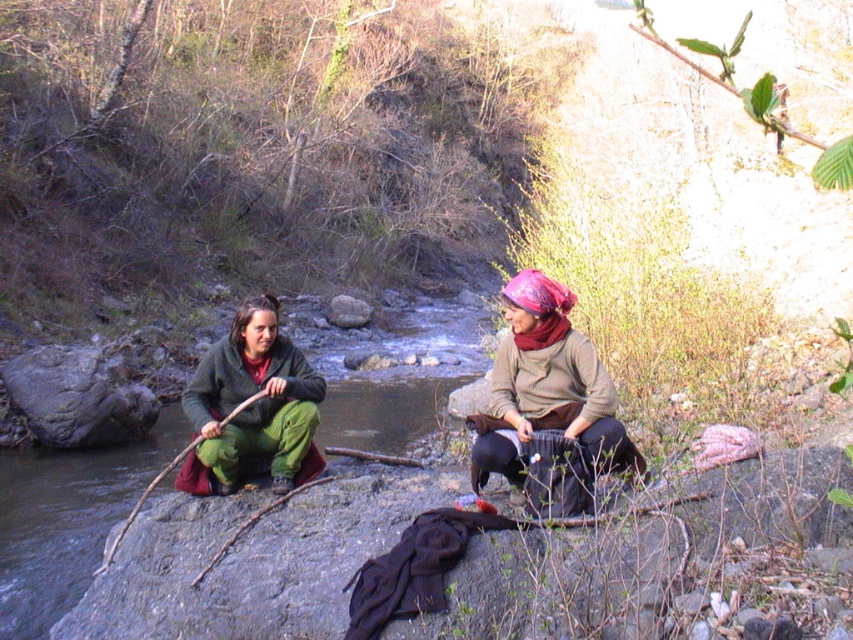
You are trying to decide whether to place a rectangular box that is 1 meter wide between the matte brown scarf at center and the green fuzzy pants at left. Based on their widths, can the box fit between them without overlapping?

The matte brown scarf at center might be wider than green fuzzy pants at left, so the box that is 1 meter wide may not fit between them if the scarf is indeed wider, but since the exact width difference is uncertain, it is risky to assume it will fit without more precise measurements.